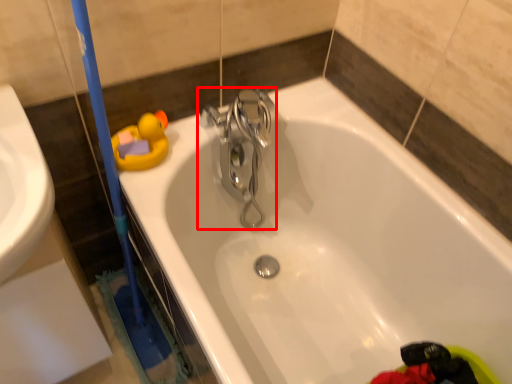
Question: In this image, where is tap (annotated by the red box) located relative to bathtub?

Choices:
 (A) right
 (B) left

Answer: (B)